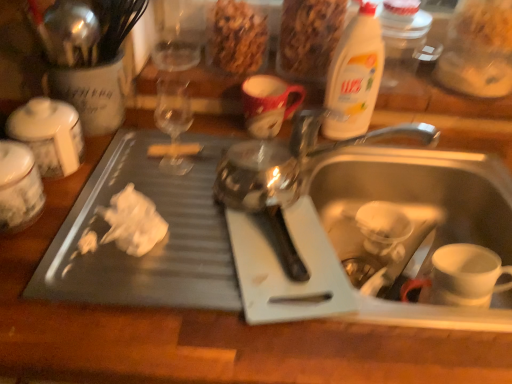
The width and height of the screenshot is (512, 384). What are the coordinates of `vacant space to the right of granular brown cereal at upper center, positioned as the first food in right-to-left order` in the screenshot? It's located at (403, 79).